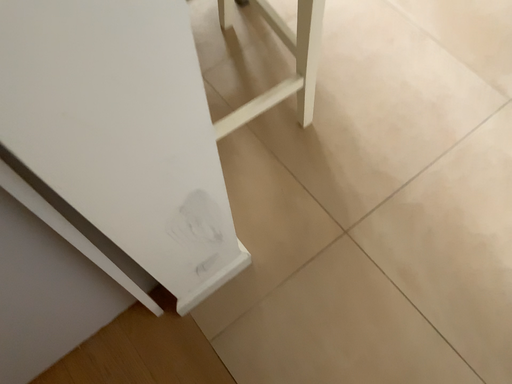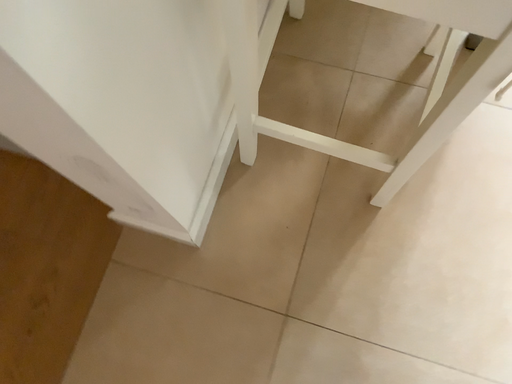
Question: How did the camera likely rotate when shooting the video?

Choices:
 (A) rotated right
 (B) rotated left

Answer: (B)